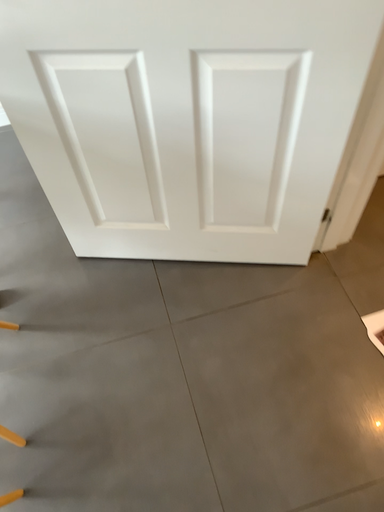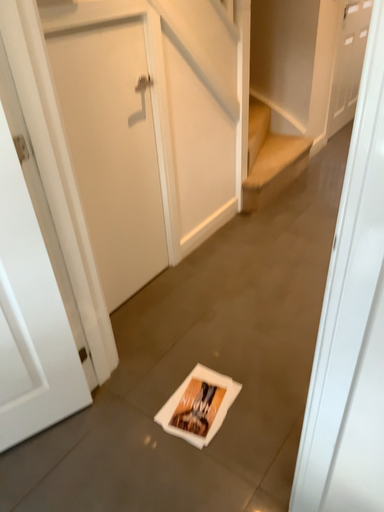
Question: How did the camera likely rotate when shooting the video?

Choices:
 (A) rotated downward
 (B) rotated upward

Answer: (B)